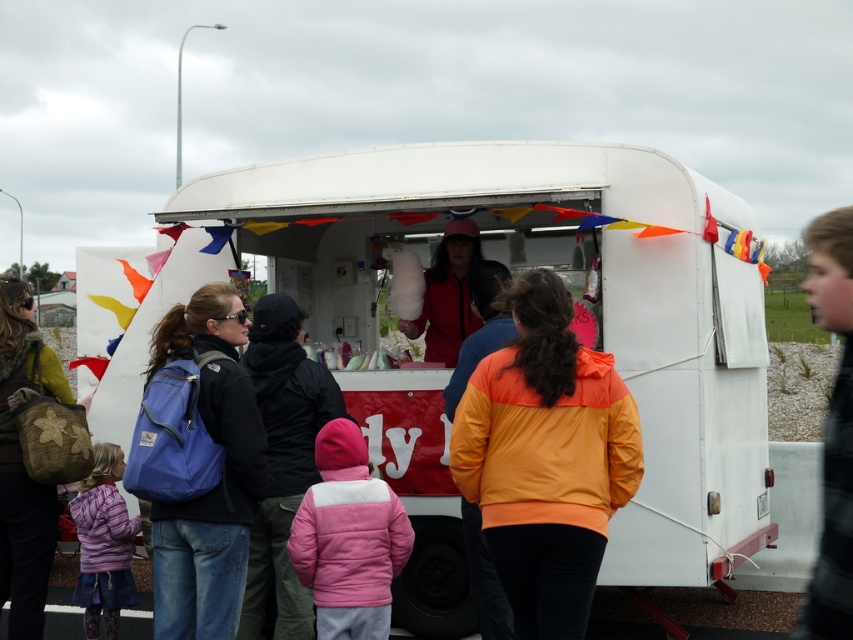
You are standing at the fair and want to approach the food trailer. You see a pink fleece jacket at center and a green textured backpack at left. Which object is nearer to you?

The pink fleece jacket at center is closer to the viewer than the green textured backpack at left.

You are standing at the fair and want to take a photo of both the cotton candy and the food trailer. You notice two points marked in the image. Which point is closer to you, point [219,346] or point [422,321]?

Point [219,346] is closer to you than point [422,321].

You are a person trying to walk through the crowd in front of the food trailer. There is a pink fleece jacket at center and a green textured backpack at left. Which object is wider so you can decide which side to walk around?

The pink fleece jacket at center is wider than the green textured backpack at left, so you should walk around the backpack at the left side to have more space.